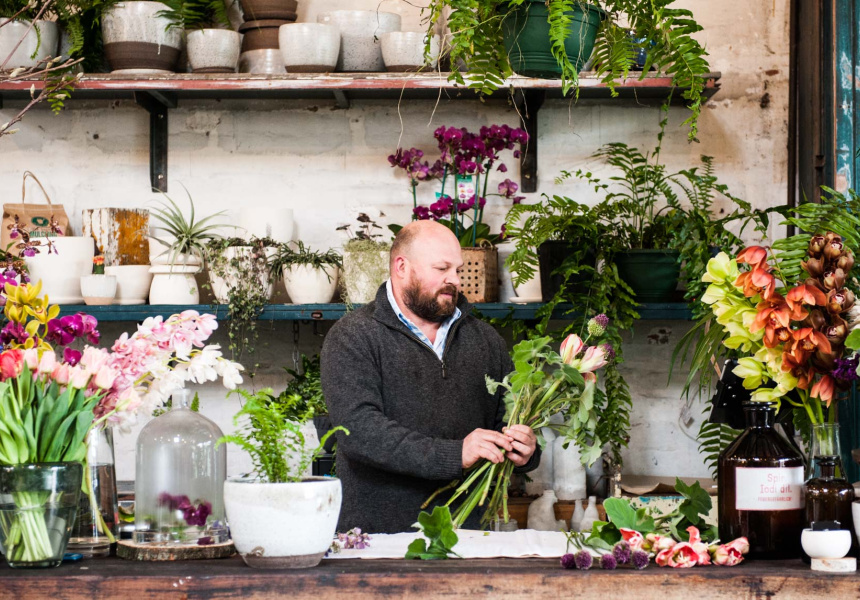
Locate an element on the screen. Image resolution: width=860 pixels, height=600 pixels. clear vase is located at coordinates (180, 467).